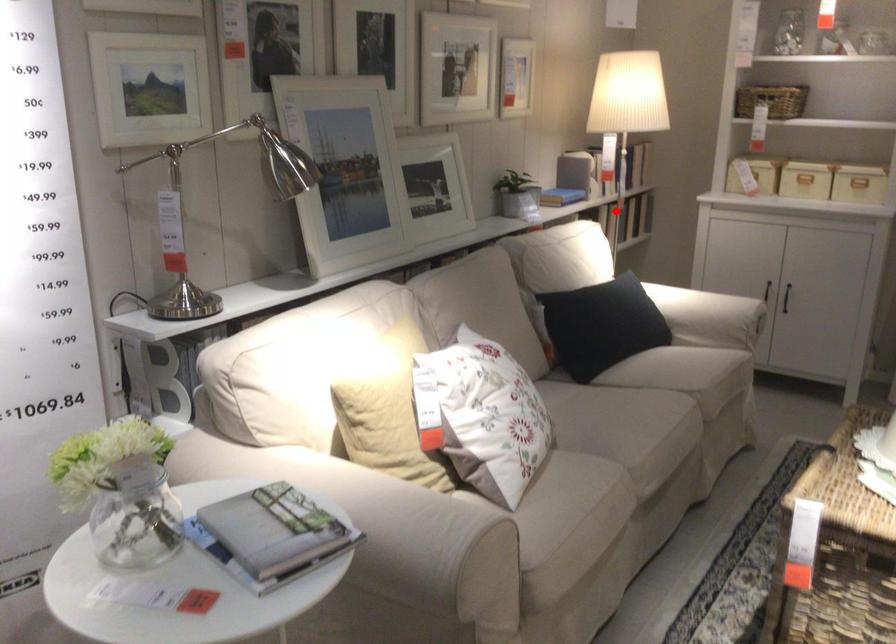
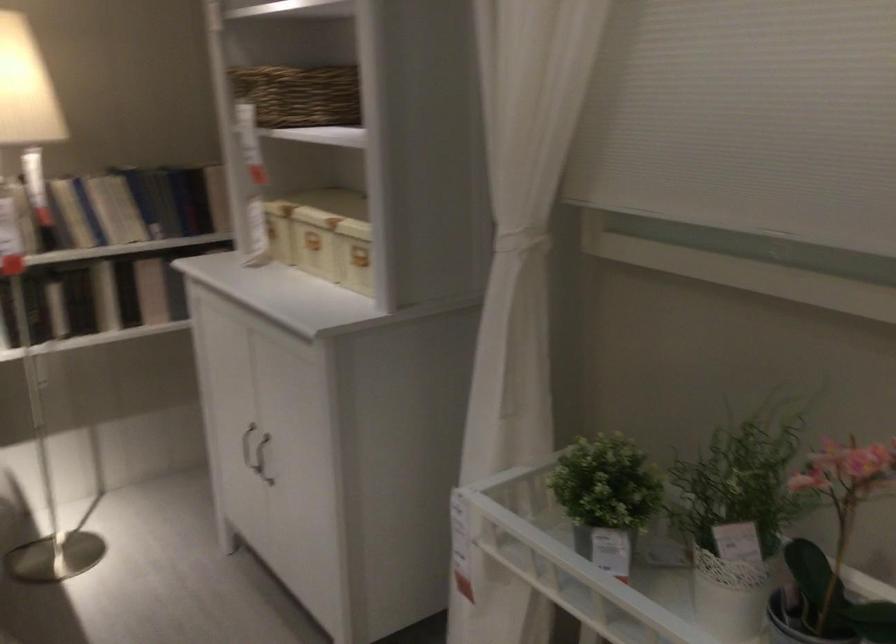
Question: I am providing you with two images of the same scene from different viewpoints. In image1, a red point is highlighted. Considering the same 3D point in image2, which of the following is correct?

Choices:
 (A) It is closer
 (B) It is farther

Answer: (A)